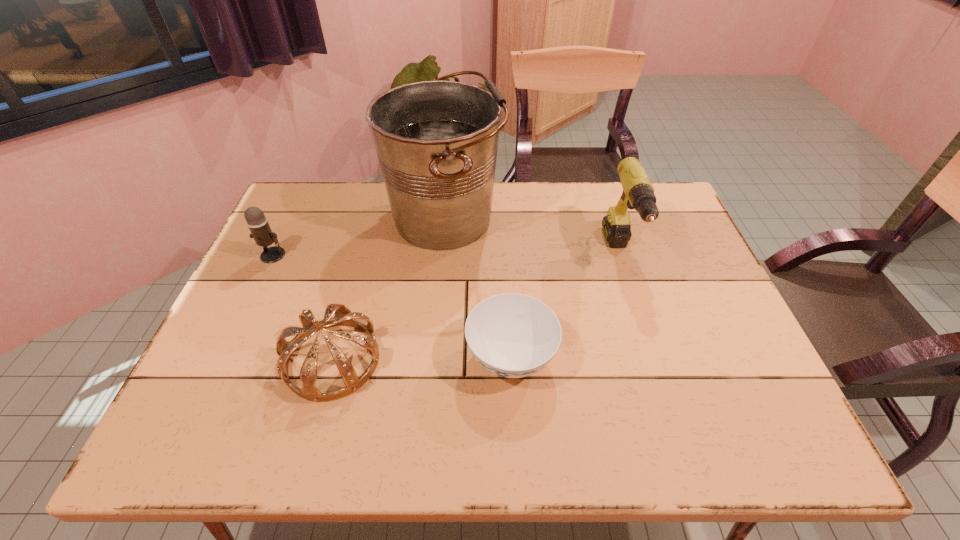
You are a GUI agent. You are given a task and a screenshot of the screen. Output one action in this format:
    pyautogui.click(x=<x>, y=<y>)
    Task: Click on the bucket
    The height and width of the screenshot is (540, 960).
    Given the screenshot: What is the action you would take?
    pyautogui.click(x=436, y=141)

Identify the location of the fourth shortest object. The image size is (960, 540). (638, 193).

Where is `the rightmost object`? The height and width of the screenshot is (540, 960). the rightmost object is located at coordinates pyautogui.click(x=638, y=193).

At what (x,y) coordinates should I click in order to perform the action: click on microphone. Please return your answer as a coordinate pair (x, y). The width and height of the screenshot is (960, 540). Looking at the image, I should click on (257, 223).

Locate an element on the screen. the fourth tallest object is located at coordinates (343, 317).

Locate an element on the screen. The width and height of the screenshot is (960, 540). chinaware is located at coordinates point(511,335).

Identify the location of vacant space located on the left of the tallest object. Image resolution: width=960 pixels, height=540 pixels. (312, 218).

This screenshot has width=960, height=540. What are the coordinates of `free spot located on the handle side of the rightmost object` in the screenshot? It's located at (664, 393).

The width and height of the screenshot is (960, 540). Find the location of `vacant space located on the front of the microphone`. vacant space located on the front of the microphone is located at coordinates (225, 359).

This screenshot has width=960, height=540. Find the location of `free space located on the right of the tiara`. free space located on the right of the tiara is located at coordinates (536, 360).